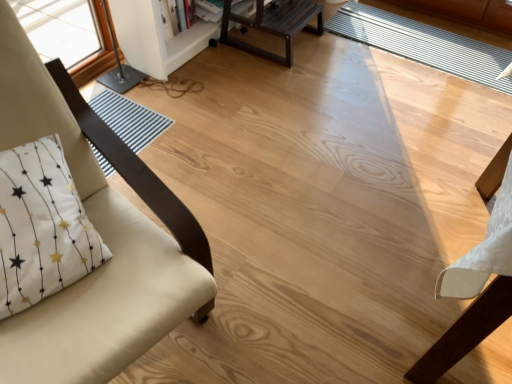
Question: Does white painted wood bookshelf at upper center come behind whitetextured fabricpillow at left?

Choices:
 (A) no
 (B) yes

Answer: (B)

Question: Is white painted wood bookshelf at upper center placed right next to whitetextured fabricpillow at left?

Choices:
 (A) yes
 (B) no

Answer: (B)

Question: Can you confirm if white painted wood bookshelf at upper center is positioned to the left of whitetextured fabricpillow at left?

Choices:
 (A) no
 (B) yes

Answer: (A)

Question: Is white painted wood bookshelf at upper center not near whitetextured fabricpillow at left?

Choices:
 (A) yes
 (B) no

Answer: (A)

Question: Can you confirm if white painted wood bookshelf at upper center is wider than whitetextured fabricpillow at left?

Choices:
 (A) no
 (B) yes

Answer: (B)

Question: From the image's perspective, is white painted wood bookshelf at upper center on whitetextured fabricpillow at left?

Choices:
 (A) yes
 (B) no

Answer: (A)

Question: Does dark brown wood table at upper center have a smaller size compared to beige fabric chair at left?

Choices:
 (A) no
 (B) yes

Answer: (B)

Question: Can you confirm if dark brown wood table at upper center is wider than beige fabric chair at left?

Choices:
 (A) no
 (B) yes

Answer: (A)

Question: From the image's perspective, would you say dark brown wood table at upper center is positioned over beige fabric chair at left?

Choices:
 (A) no
 (B) yes

Answer: (B)

Question: Is dark brown wood table at upper center oriented away from beige fabric chair at left?

Choices:
 (A) yes
 (B) no

Answer: (B)

Question: Considering the relative sizes of dark brown wood table at upper center and beige fabric chair at left in the image provided, is dark brown wood table at upper center thinner than beige fabric chair at left?

Choices:
 (A) yes
 (B) no

Answer: (A)

Question: Does dark brown wood table at upper center have a larger size compared to beige fabric chair at left?

Choices:
 (A) no
 (B) yes

Answer: (A)

Question: Is white painted wood bookshelf at upper center oriented away from white striped mat at center?

Choices:
 (A) no
 (B) yes

Answer: (A)